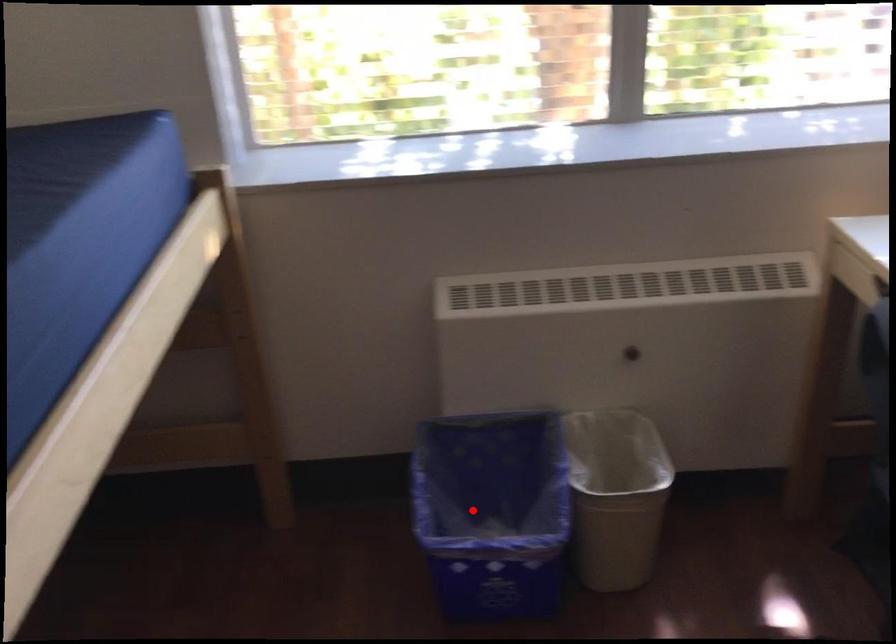
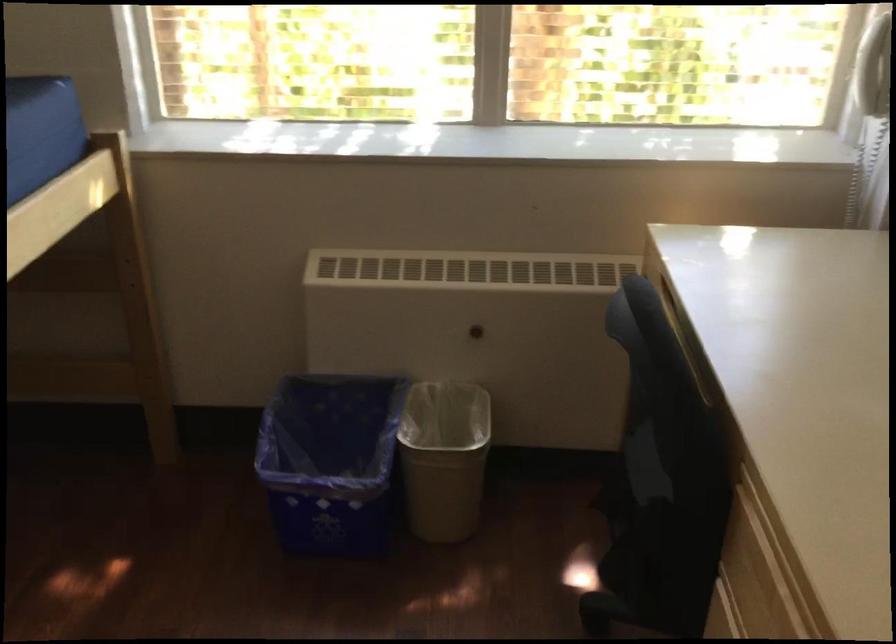
Question: I am providing you with two images of the same scene from different viewpoints. Image1 has a red point marked. In image2, the corresponding 3D location appears at what relative position? Reply with the corresponding letter.

Choices:
 (A) Closer
 (B) Farther

Answer: (B)